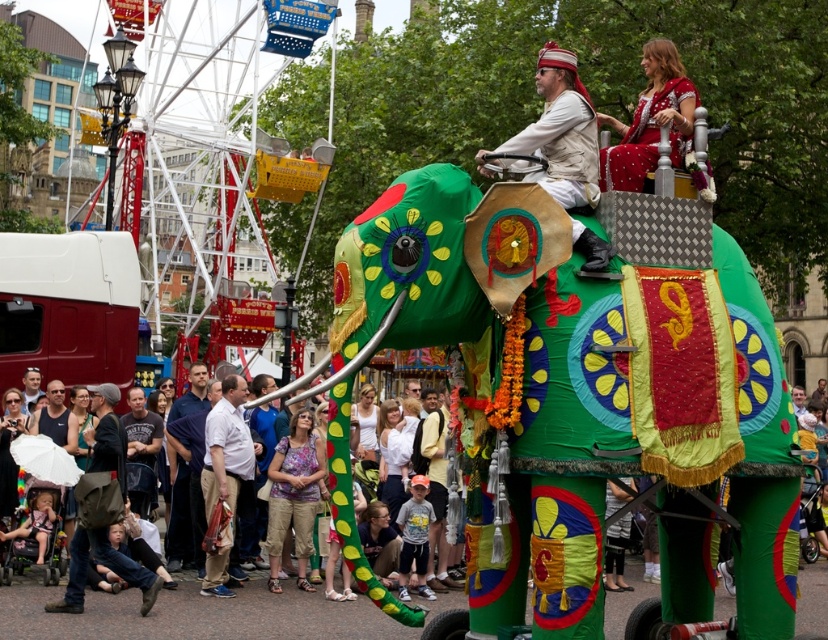
You are a photographer trying to capture the perfect shot of the green fabric elephant at center and the dark blue shirt at center. To ensure both are in frame, you need to know their positions relative to each other. Which object is positioned to the right of the other?

The green fabric elephant at center is to the right of the dark blue shirt at center.